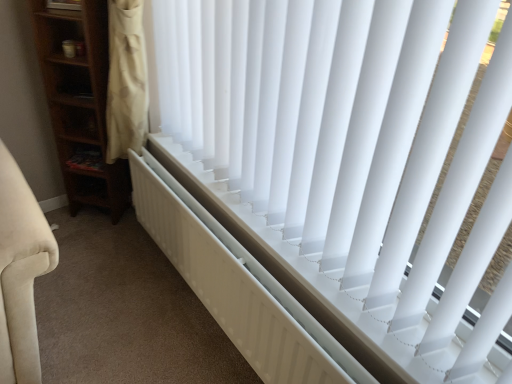
Question: Considering the relative positions of wooden shelf at left and white matte radiator at center in the image provided, is wooden shelf at left in front of white matte radiator at center?

Choices:
 (A) no
 (B) yes

Answer: (A)

Question: From a real-world perspective, is wooden shelf at left located higher than white matte radiator at center?

Choices:
 (A) yes
 (B) no

Answer: (A)

Question: Does wooden shelf at left touch white matte radiator at center?

Choices:
 (A) yes
 (B) no

Answer: (B)

Question: Considering the relative positions of wooden shelf at left and white matte radiator at center in the image provided, is wooden shelf at left to the right of white matte radiator at center from the viewer's perspective?

Choices:
 (A) yes
 (B) no

Answer: (B)

Question: Is wooden shelf at left wider than white matte radiator at center?

Choices:
 (A) yes
 (B) no

Answer: (A)

Question: Considering the positions of white matte radiator at center and wooden shelf at left in the image, is white matte radiator at center bigger or smaller than wooden shelf at left?

Choices:
 (A) big
 (B) small

Answer: (A)

Question: From the image's perspective, is white matte radiator at center above or below wooden shelf at left?

Choices:
 (A) below
 (B) above

Answer: (A)

Question: Considering the positions of white matte radiator at center and wooden shelf at left in the image, is white matte radiator at center taller or shorter than wooden shelf at left?

Choices:
 (A) tall
 (B) short

Answer: (A)

Question: Choose the correct answer: Is white matte radiator at center inside wooden shelf at left or outside it?

Choices:
 (A) inside
 (B) outside

Answer: (B)

Question: In terms of width, does wooden shelf at left look wider or thinner when compared to white matte radiator at center?

Choices:
 (A) thin
 (B) wide

Answer: (B)

Question: Is wooden shelf at left situated inside white matte radiator at center or outside?

Choices:
 (A) inside
 (B) outside

Answer: (B)

Question: Is point (96, 162) positioned closer to the camera than point (151, 185)?

Choices:
 (A) closer
 (B) farther

Answer: (B)

Question: Is wooden shelf at left in front of or behind white matte radiator at center in the image?

Choices:
 (A) behind
 (B) front

Answer: (A)

Question: Is wooden shelf at left wider or thinner than white plastic blinds at center?

Choices:
 (A) wide
 (B) thin

Answer: (B)

Question: From a real-world perspective, relative to white plastic blinds at center, is wooden shelf at left vertically above or below?

Choices:
 (A) above
 (B) below

Answer: (B)